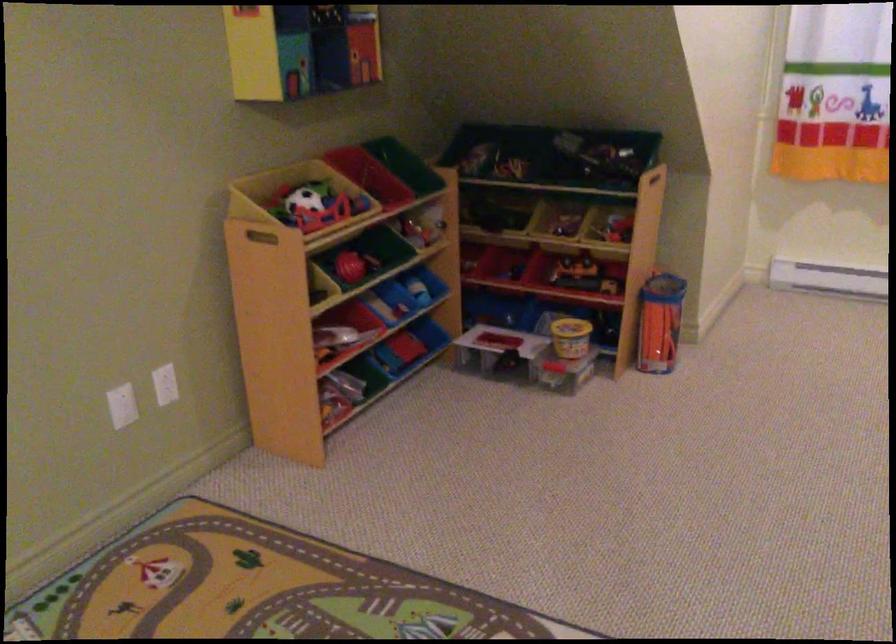
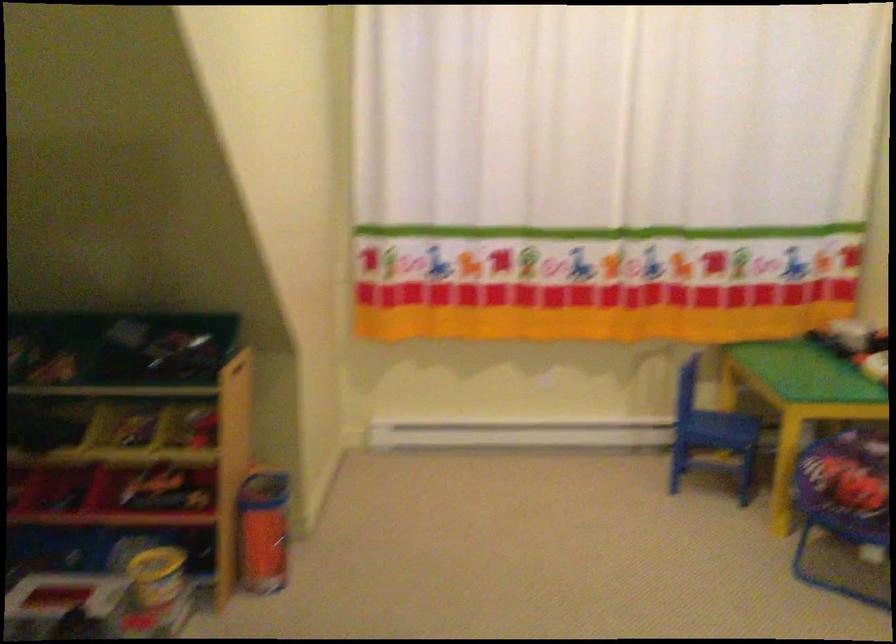
In the second image, find the point that corresponds to the point at 563,243 in the first image.

(145, 457)